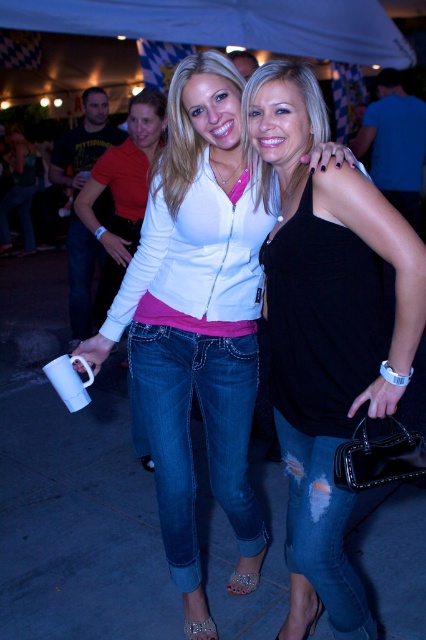
Question: Is jeans at center below matte white shirt at center?

Choices:
 (A) yes
 (B) no

Answer: (A)

Question: Can you confirm if jeans at center is thinner than ripped denim jeans at lower right?

Choices:
 (A) yes
 (B) no

Answer: (B)

Question: Does black matte tank top at center appear on the left side of white matte shirt at upper center?

Choices:
 (A) no
 (B) yes

Answer: (A)

Question: Which point is farther to the camera?

Choices:
 (A) (356, 176)
 (B) (360, 22)
 (C) (26, 250)

Answer: (B)

Question: Which point is closer to the camera?

Choices:
 (A) (232, 461)
 (B) (216, 168)
 (C) (294, 444)

Answer: (B)

Question: Among these points, which one is nearest to the camera?

Choices:
 (A) (236, 486)
 (B) (328, 436)
 (C) (356, 179)
 (D) (11, 196)

Answer: (C)